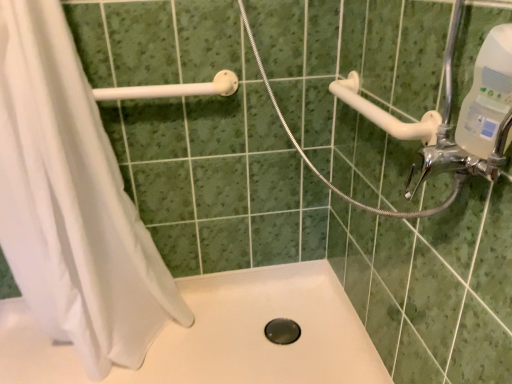
Question: From a real-world perspective, is white plastic grab bar at upper left, the first shower in the left-to-right sequence, physically located above or below white fabric shower curtain at left?

Choices:
 (A) below
 (B) above

Answer: (B)

Question: Would you say white plastic grab bar at upper left, the first shower in the left-to-right sequence, is to the left or to the right of white fabric shower curtain at left in the picture?

Choices:
 (A) right
 (B) left

Answer: (A)

Question: Which object is positioned farthest from the black rubber hole at center?

Choices:
 (A) white fabric shower curtain at left
 (B) white plastic grab bar at upper left, the first shower in the left-to-right sequence
 (C) white plastic grab bar at upper right, the 2th shower positioned from the left
 (D) white matte bath at center
 (E) chrome metallic faucet at upper right

Answer: (E)

Question: Which object is the farthest from the chrome metallic faucet at upper right?

Choices:
 (A) white plastic grab bar at upper left, the first shower in the left-to-right sequence
 (B) white plastic grab bar at upper right, the 2th shower positioned from the left
 (C) white fabric shower curtain at left
 (D) white matte bath at center
 (E) black rubber hole at center

Answer: (C)